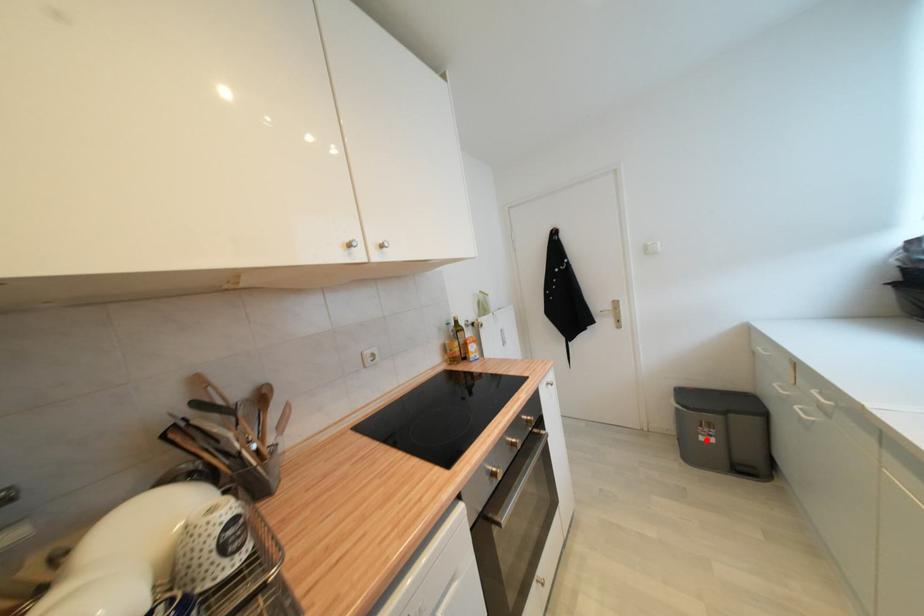
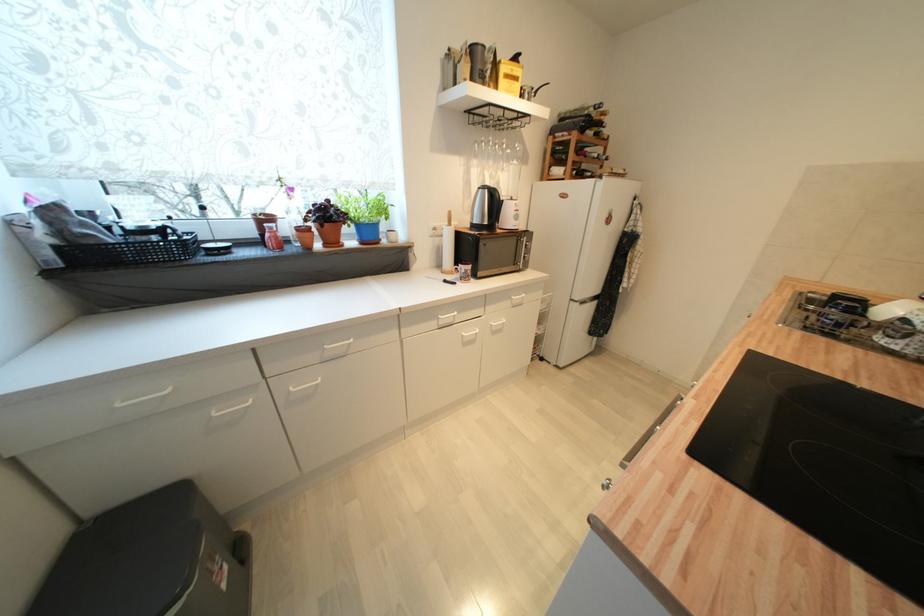
Question: I am providing you with two images of the same scene from different viewpoints. Given a red point in image1, look at the same physical point in image2. Is it:

Choices:
 (A) Closer to the viewpoint
 (B) Farther from the viewpoint

Answer: (B)